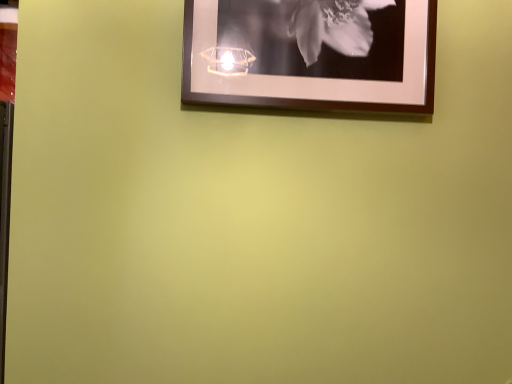
Describe the element at coordinates (311, 54) in the screenshot. I see `wooden picture frame at upper center` at that location.

Locate an element on the screen. wooden picture frame at upper center is located at coordinates (311, 54).

In order to click on wooden picture frame at upper center in this screenshot , I will do `click(311, 54)`.